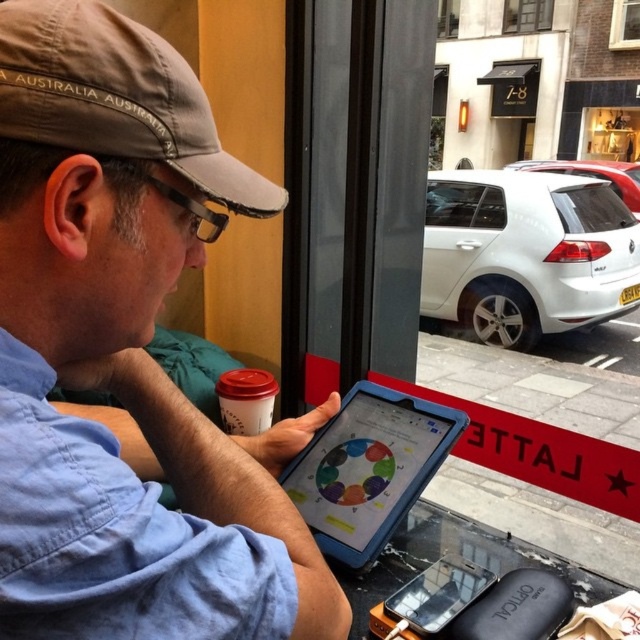
Question: Considering the relative positions of blue fabric shirt at center and gray fabric baseball cap at upper left in the image provided, where is blue fabric shirt at center located with respect to gray fabric baseball cap at upper left?

Choices:
 (A) left
 (B) right

Answer: (A)

Question: Based on their relative distances, which object is farther from the matte plastic tablet at center?

Choices:
 (A) blue fabric shirt at center
 (B) blue rubberized tablet at center

Answer: (A)

Question: Considering the real-world distances, which object is closest to the white matte car at right?

Choices:
 (A) clear glass window at upper right
 (B) gray fabric baseball cap at upper left
 (C) clear glass window at upper center

Answer: (A)

Question: Among these points, which one is farthest from the camera?

Choices:
 (A) (388, 465)
 (B) (58, 116)

Answer: (A)

Question: Does white matte car at right appear over blue rubberized tablet at center?

Choices:
 (A) no
 (B) yes

Answer: (B)

Question: Is blue rubberized tablet at center smaller than clear glass window at upper right?

Choices:
 (A) yes
 (B) no

Answer: (A)